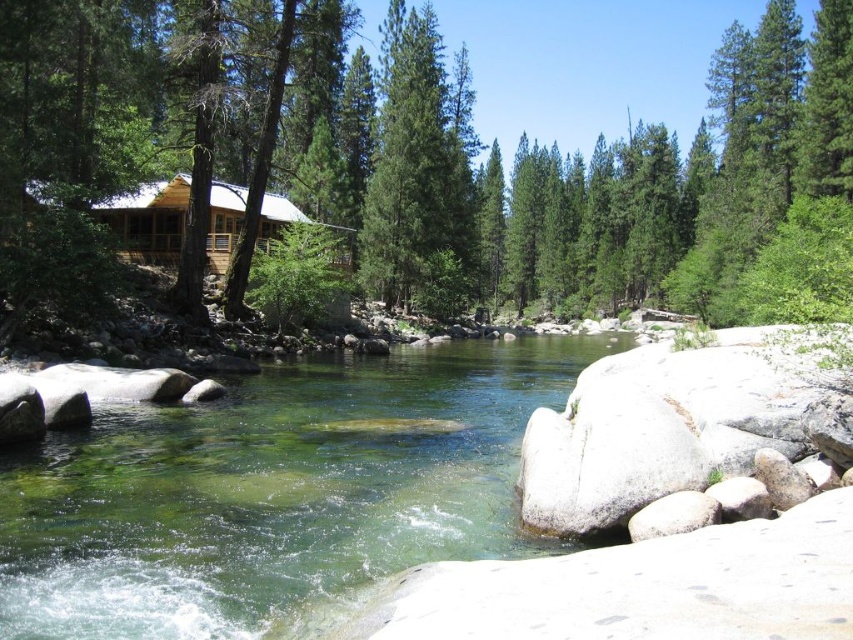
You are planning to build a small garden between the green textured tree at center and the green textured pine tree at center. Which tree has a larger canopy to provide more shade for the garden?

The green textured tree at center might be wider than the green textured pine tree at center, so it likely has a larger canopy and can provide more shade for the garden.

You are a hiker who wants to take a photo of the green textured tree at center and the clear glass water at center from a distance. If your camera can focus on objects up to 50 meters away, will you be able to capture both clearly in one shot?

The green textured tree at center is 53.40 meters away from clear glass water at center. Since the camera can only focus up to 50 meters, the distance between them exceeds the camera range. You cannot capture both clearly in one shot.

You are planning to build a small garden between the green textured tree at center and the clear glass water at center. Which object should you place closer to the tree to ensure the garden has enough space?

The green textured tree at center is wider than the clear glass water at center, so you should place the garden closer to the tree to accommodate its larger width.